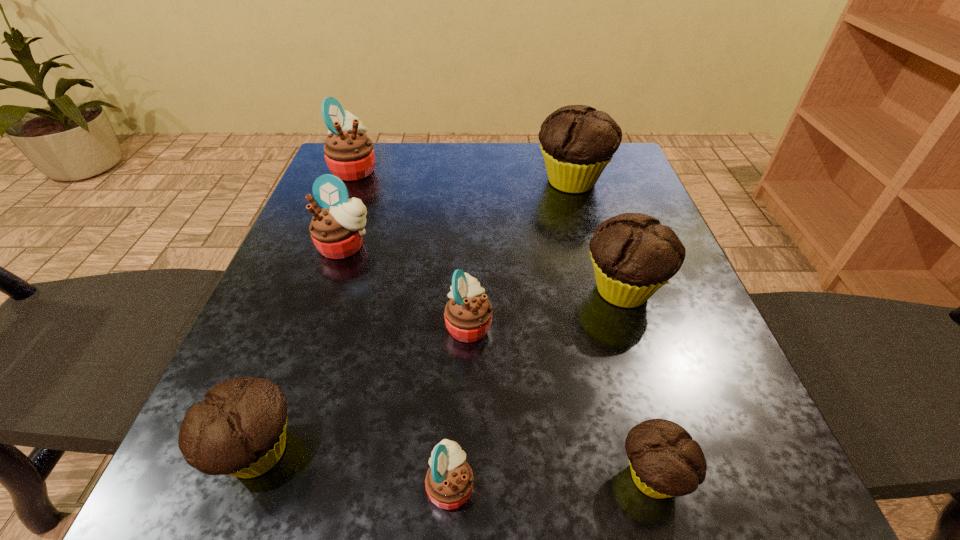
This screenshot has width=960, height=540. Identify the location of free space located 0.340m on the front-facing side of the second biggest pink muffin. (282, 430).

Find the location of a particular element. The width and height of the screenshot is (960, 540). free space located 0.110m on the front of the third smallest chocolate muffin is located at coordinates (653, 377).

Locate an element on the screen. This screenshot has height=540, width=960. vacant space located on the front-facing side of the third farthest pink muffin is located at coordinates (648, 325).

Identify the location of vacant position located on the back of the leftmost chocolate muffin. This screenshot has width=960, height=540. (284, 380).

You are a GUI agent. You are given a task and a screenshot of the screen. Output one action in this format:
    pyautogui.click(x=<x>, y=<y>)
    Task: Click on the vacant space positioned 0.090m on the front-facing side of the smallest pink muffin
    
    Given the screenshot: What is the action you would take?
    pyautogui.click(x=546, y=485)

What are the coordinates of `free space located on the right of the smallest chocolate muffin` in the screenshot? It's located at (735, 476).

What are the coordinates of `object located at the far left corner` in the screenshot? It's located at coord(349,153).

Where is `object at the near left corner`? Image resolution: width=960 pixels, height=540 pixels. object at the near left corner is located at coordinates (239, 430).

Locate an element on the screen. Image resolution: width=960 pixels, height=540 pixels. object present at the far right corner is located at coordinates (577, 141).

Where is `object located at the near right corner`? This screenshot has height=540, width=960. object located at the near right corner is located at coordinates (665, 461).